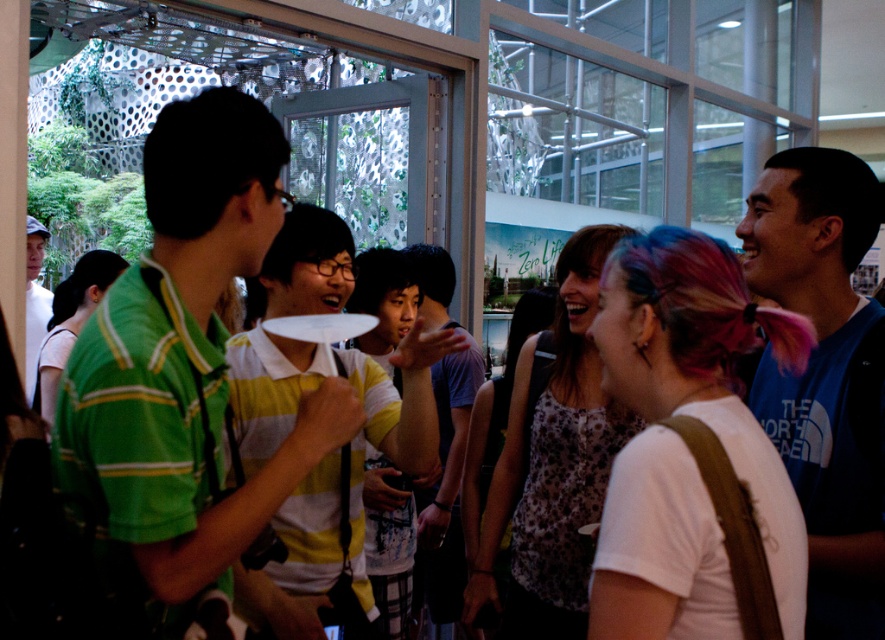
You are organizing a small party and need to decide whether to place a snack on the matte white cap at left or the white paper plate at center. Based on their sizes, which object is wider and thus more suitable for holding a larger snack?

The matte white cap at left is wider than the white paper plate at center, so it is more suitable for holding a larger snack.